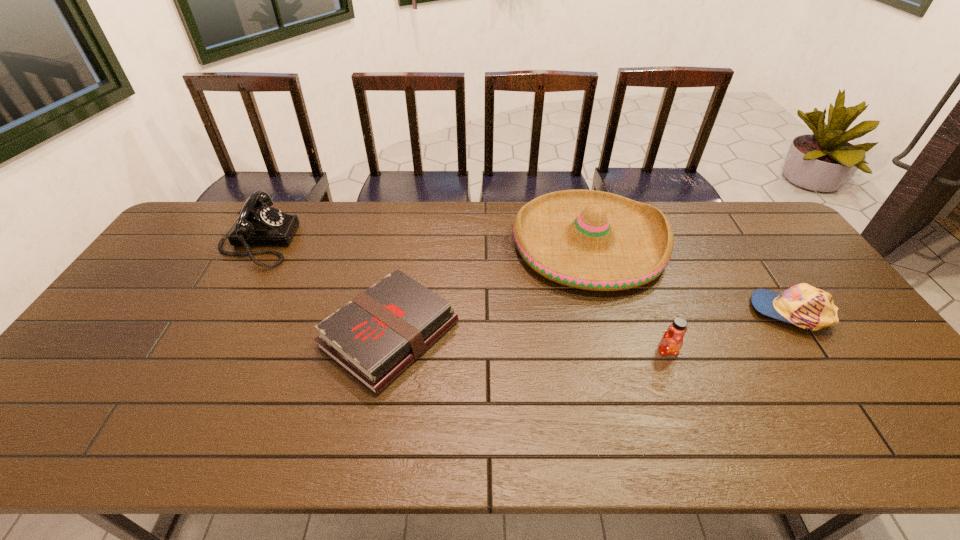
At what (x,y) coordinates should I click in order to perform the action: click on free space located on the bill of the cap. Please return your answer as a coordinate pair (x, y). The height and width of the screenshot is (540, 960). Looking at the image, I should click on (687, 312).

Find the location of a particular element. This screenshot has height=540, width=960. vacant area situated 0.390m on the bill of the cap is located at coordinates (612, 312).

Identify the location of free location located 0.320m on the right of the fourth object from right to left. The image size is (960, 540). (578, 335).

At what (x,y) coordinates should I click in order to perform the action: click on sombrero situated at the far edge. Please return your answer as a coordinate pair (x, y). Looking at the image, I should click on click(x=592, y=240).

At what (x,y) coordinates should I click in order to perform the action: click on telephone located at the far edge. Please return your answer as a coordinate pair (x, y). The width and height of the screenshot is (960, 540). Looking at the image, I should click on click(x=259, y=224).

Locate an element on the screen. This screenshot has width=960, height=540. object that is at the right edge is located at coordinates [805, 306].

In the image, there is a desktop. Where is `blank space at the far edge`? blank space at the far edge is located at coordinates (495, 241).

This screenshot has height=540, width=960. In order to click on vacant space at the near edge in this screenshot , I will do `click(812, 426)`.

The width and height of the screenshot is (960, 540). I want to click on vacant space at the left edge of the desktop, so click(x=104, y=372).

What are the coordinates of `vacant space at the right edge` in the screenshot? It's located at (833, 369).